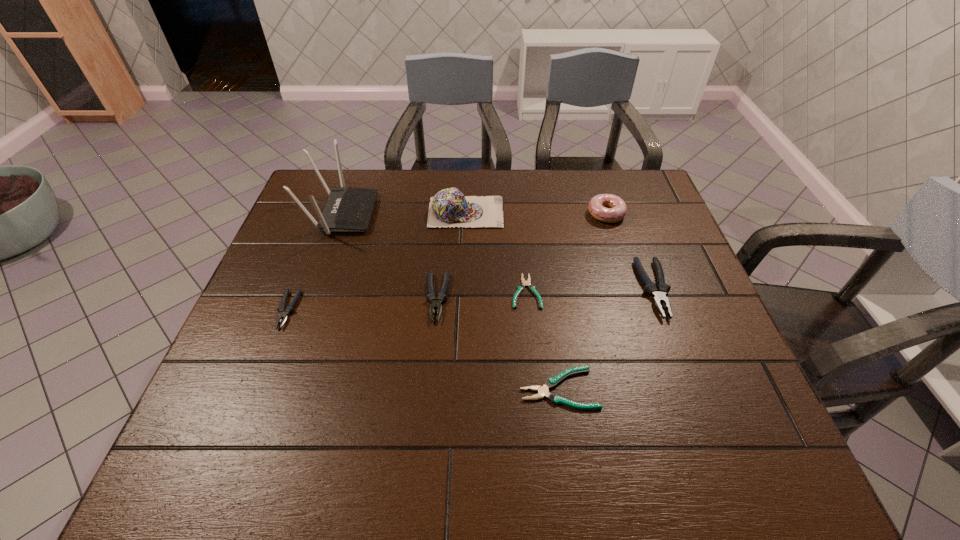
The height and width of the screenshot is (540, 960). I want to click on object at the far right corner, so click(x=617, y=209).

Find the location of a particular element. The image size is (960, 540). free space at the far edge of the desktop is located at coordinates (404, 205).

Identify the location of vacant region at the near edge of the desktop. (276, 464).

What are the coordinates of `free space at the left edge of the desktop` in the screenshot? It's located at (303, 223).

In the image, there is a desktop. At what (x,y) coordinates should I click in order to perform the action: click on free space at the right edge. Please return your answer as a coordinate pair (x, y). The height and width of the screenshot is (540, 960). Looking at the image, I should click on (678, 377).

You are a GUI agent. You are given a task and a screenshot of the screen. Output one action in this format:
    pyautogui.click(x=<x>, y=<y>)
    Task: Click on the vacant space that is in between the biggest gray pliers and the third tallest object
    
    Given the screenshot: What is the action you would take?
    pyautogui.click(x=630, y=251)

Where is `empty location between the fourth tallest pliers and the fourth shortest pliers`? The height and width of the screenshot is (540, 960). empty location between the fourth tallest pliers and the fourth shortest pliers is located at coordinates (498, 343).

Where is `unoccupied area between the seventh shortest object and the farther teal pliers`? The image size is (960, 540). unoccupied area between the seventh shortest object and the farther teal pliers is located at coordinates (496, 252).

This screenshot has width=960, height=540. In order to click on empty space between the sixth shortest object and the rightmost gray pliers in this screenshot , I will do `click(630, 251)`.

Where is `free space between the leftmost pliers and the tallest object`? This screenshot has width=960, height=540. free space between the leftmost pliers and the tallest object is located at coordinates [315, 262].